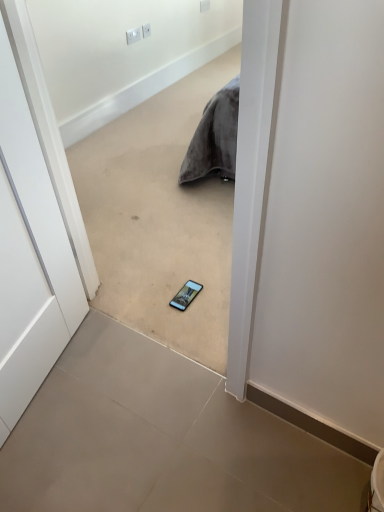
Question: Is white matte door at center turned away from gray tile floor at center, which is the 1th concrete in top-to-bottom order?

Choices:
 (A) no
 (B) yes

Answer: (A)

Question: From a real-world perspective, is white matte door at center on gray tile floor at center, which is the 1th concrete in top-to-bottom order?

Choices:
 (A) yes
 (B) no

Answer: (B)

Question: Is white matte door at center completely or partially outside of gray tile floor at center, placed as the second concrete when sorted from bottom to top?

Choices:
 (A) yes
 (B) no

Answer: (A)

Question: Is white matte door at center directly adjacent to gray tile floor at center, which is the 1th concrete in top-to-bottom order?

Choices:
 (A) no
 (B) yes

Answer: (A)

Question: Can you confirm if white matte door at center is wider than gray tile floor at center, which is the 1th concrete in top-to-bottom order?

Choices:
 (A) no
 (B) yes

Answer: (A)

Question: In terms of width, does gray tile floor at center, which is the 1th concrete in top-to-bottom order, look wider or thinner when compared to white plastic electric outlet at upper center, the second electric outlet from the right?

Choices:
 (A) wide
 (B) thin

Answer: (A)

Question: In the image, is gray tile floor at center, placed as the second concrete when sorted from bottom to top, on the left side or the right side of white plastic electric outlet at upper center, the second electric outlet from the right?

Choices:
 (A) left
 (B) right

Answer: (B)

Question: In terms of height, does gray tile floor at center, which is the 1th concrete in top-to-bottom order, look taller or shorter compared to white plastic electric outlet at upper center, the 2th electric outlet from the back?

Choices:
 (A) tall
 (B) short

Answer: (A)

Question: Is gray tile floor at center, placed as the second concrete when sorted from bottom to top, bigger or smaller than white plastic electric outlet at upper center, which is counted as the 2th electric outlet, starting from the top?

Choices:
 (A) big
 (B) small

Answer: (A)

Question: Would you say white plastic electric outlet at upper center, which is the 3th electric outlet in right-to-left order, is inside or outside gray tile floor at center, which is the 1th concrete in top-to-bottom order?

Choices:
 (A) outside
 (B) inside

Answer: (A)

Question: From a real-world perspective, is white plastic electric outlet at upper center, the 1th electric outlet in the bottom-to-top sequence, physically located above or below gray tile floor at center, placed as the second concrete when sorted from bottom to top?

Choices:
 (A) below
 (B) above

Answer: (A)

Question: Looking at their shapes, would you say white plastic electric outlet at upper center, the 1th electric outlet in the bottom-to-top sequence, is wider or thinner than gray tile floor at center, placed as the second concrete when sorted from bottom to top?

Choices:
 (A) wide
 (B) thin

Answer: (B)

Question: Is white plastic electric outlet at upper center, acting as the third electric outlet starting from the back, taller or shorter than gray tile floor at center, placed as the second concrete when sorted from bottom to top?

Choices:
 (A) short
 (B) tall

Answer: (A)

Question: Is white matte door at center bigger or smaller than gray tile floor at center, placed as the second concrete when sorted from bottom to top?

Choices:
 (A) big
 (B) small

Answer: (B)

Question: Is white matte door at center inside the boundaries of gray tile floor at center, placed as the second concrete when sorted from bottom to top, or outside?

Choices:
 (A) inside
 (B) outside

Answer: (B)